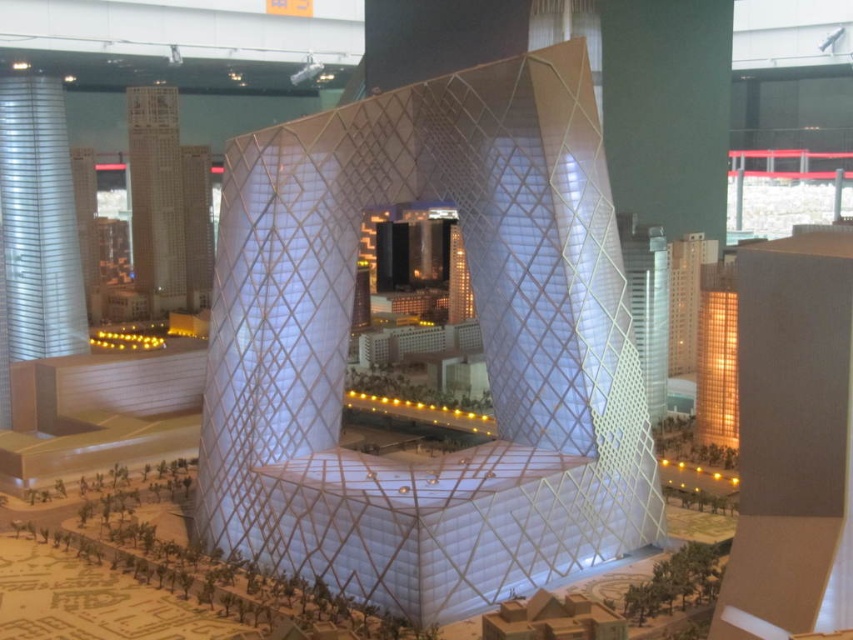
Question: Which point is farther to the camera?

Choices:
 (A) (146, 205)
 (B) (659, 387)
 (C) (1, 220)

Answer: (A)

Question: Estimate the real-world distances between objects in this image. Which object is farther from the white textured building at center?

Choices:
 (A) silver metallic tower at left
 (B) white textured building at upper left
 (C) white mesh tower at right

Answer: (B)

Question: Is white textured building at center below silver metallic tower at left?

Choices:
 (A) yes
 (B) no

Answer: (A)

Question: Does silver metallic tower at left appear on the left side of white mesh tower at right?

Choices:
 (A) yes
 (B) no

Answer: (A)

Question: Which point is closer to the camera?

Choices:
 (A) (24, 280)
 (B) (616, 484)

Answer: (B)

Question: Is white textured building at upper left smaller than white mesh tower at right?

Choices:
 (A) no
 (B) yes

Answer: (A)